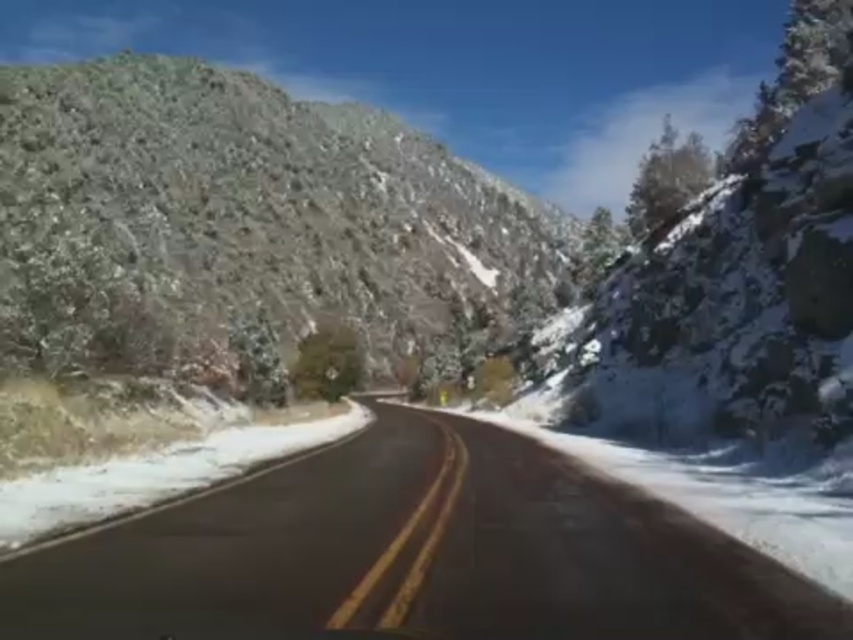
Question: Where is green rock at upper left located in relation to black asphalt road at center in the image?

Choices:
 (A) below
 (B) above

Answer: (B)

Question: Does green rock at upper left appear on the left side of black asphalt road at center?

Choices:
 (A) yes
 (B) no

Answer: (A)

Question: Which point is closer to the camera?

Choices:
 (A) black asphalt road at center
 (B) green rock at upper left

Answer: (A)

Question: From the image, what is the correct spatial relationship of green rock at upper left in relation to black asphalt road at center?

Choices:
 (A) right
 (B) left

Answer: (B)